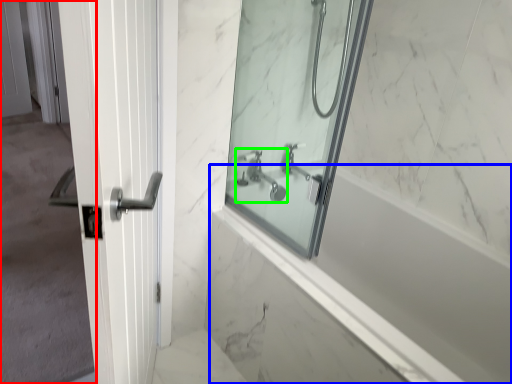
Question: Considering the real-world distances, which object is farthest from screen door (highlighted by a red box)? bath (highlighted by a blue box) or tap (highlighted by a green box)?

Choices:
 (A) bath
 (B) tap

Answer: (A)